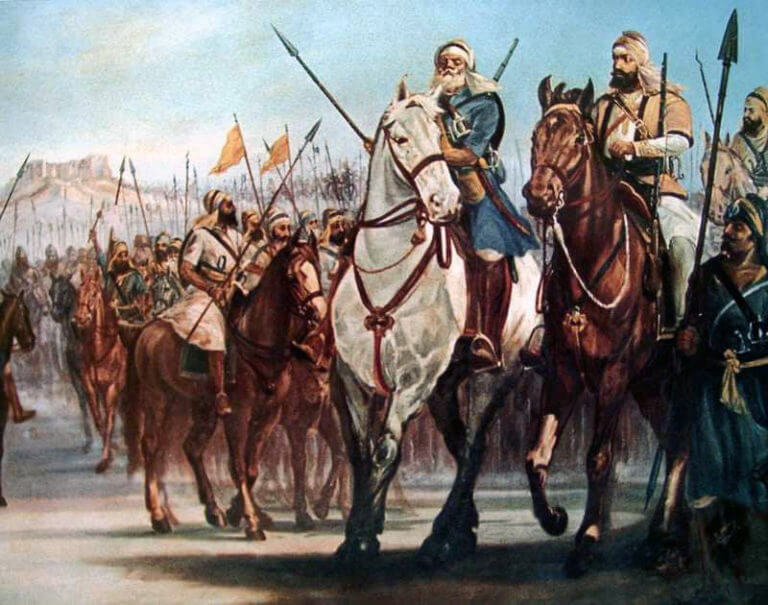
Find the location of a particular element. The width and height of the screenshot is (768, 605). blue robe is located at coordinates (488, 221), (475, 121), (131, 276).